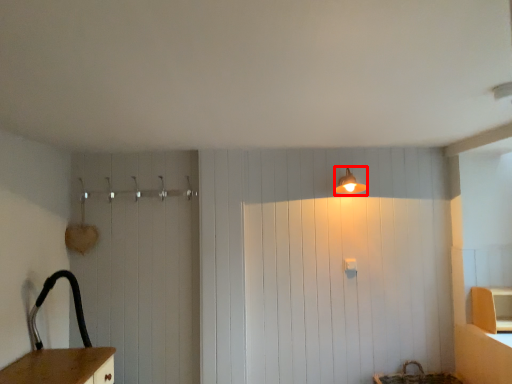
Question: From the image's perspective, what is the correct spatial relationship of light fixture (annotated by the red box) in relation to cabinetry?

Choices:
 (A) below
 (B) above

Answer: (B)